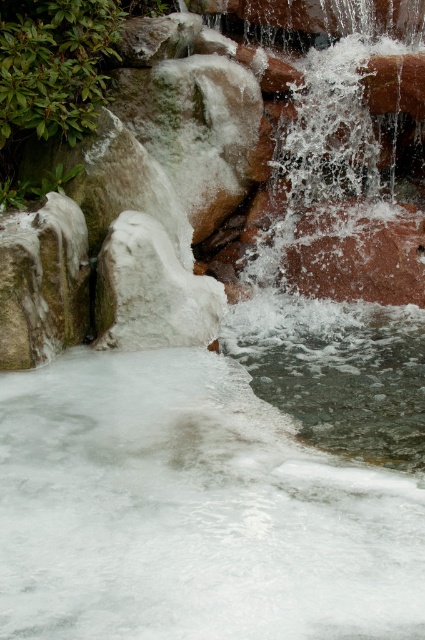
You are standing at the edge of the waterfall and see the white frosty rock at left and the white frosty rock at center. Which rock is positioned further to your left side?

The white frosty rock at left is positioned further to the left side compared to the white frosty rock at center.

You are a hiker trying to cross the shallow pool of water using the rocks. You see the white frosty rock at left and the white frosty rock at center. Can you safely step from one to the other if your average step length is 30 centimeters?

The white frosty rock at left is 28.78 centimeters away from the white frosty rock at center, so yes, you can safely step between them since your average step length of 30 centimeters is slightly longer than the distance between them.